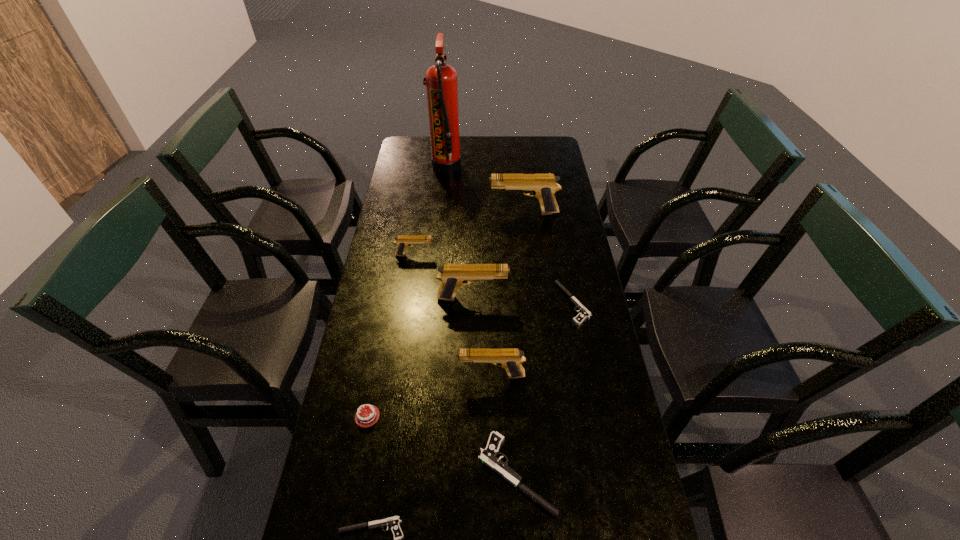
This screenshot has height=540, width=960. I want to click on the fourth shortest object, so click(366, 417).

You are a GUI agent. You are given a task and a screenshot of the screen. Output one action in this format:
    pyautogui.click(x=<x>, y=<y>)
    Task: Click on the chocolate cake
    This screenshot has width=960, height=540.
    Given the screenshot: What is the action you would take?
    pyautogui.click(x=366, y=417)

Locate an element on the screen. Image resolution: width=960 pixels, height=540 pixels. the biggest black pistol is located at coordinates (489, 455).

Identify the location of the fifth tallest pistol. Image resolution: width=960 pixels, height=540 pixels. (489, 455).

Identify the location of the second shortest pistol. Image resolution: width=960 pixels, height=540 pixels. (584, 314).

You are a GUI agent. You are given a task and a screenshot of the screen. Output one action in this format:
    pyautogui.click(x=<x>, y=<y>)
    Task: Click on the farthest black pistol
    
    Given the screenshot: What is the action you would take?
    pyautogui.click(x=584, y=314)

The width and height of the screenshot is (960, 540). I want to click on vacant space situated with the nozzle pointing from the back of the tallest object, so click(x=532, y=167).

Locate an element on the screen. The image size is (960, 540). vacant space located at the barrel of the second tallest object is located at coordinates (430, 213).

This screenshot has height=540, width=960. I want to click on free region located at the barrel of the second tallest object, so click(x=445, y=213).

Identify the location of vacant space located 0.330m at the barrel of the second tallest object. (404, 213).